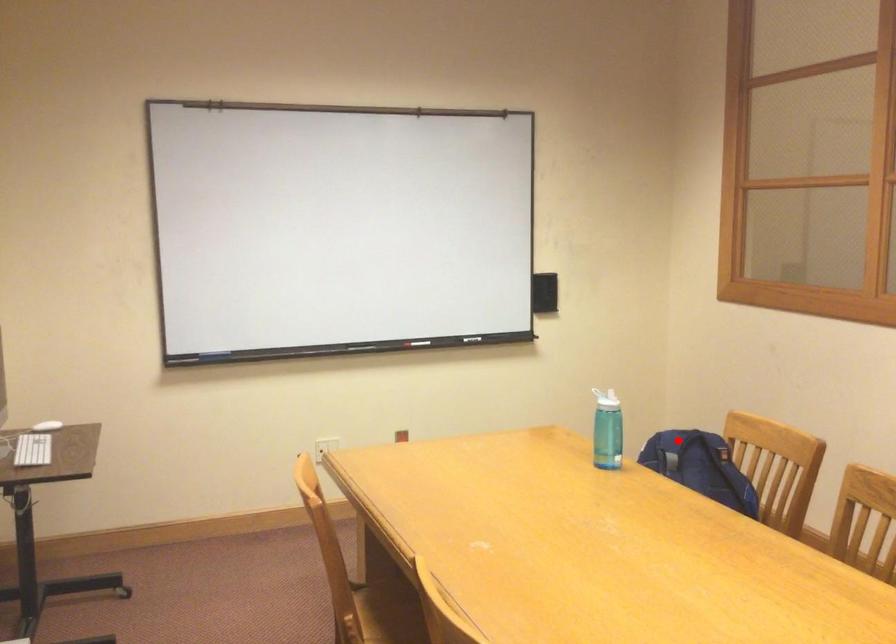
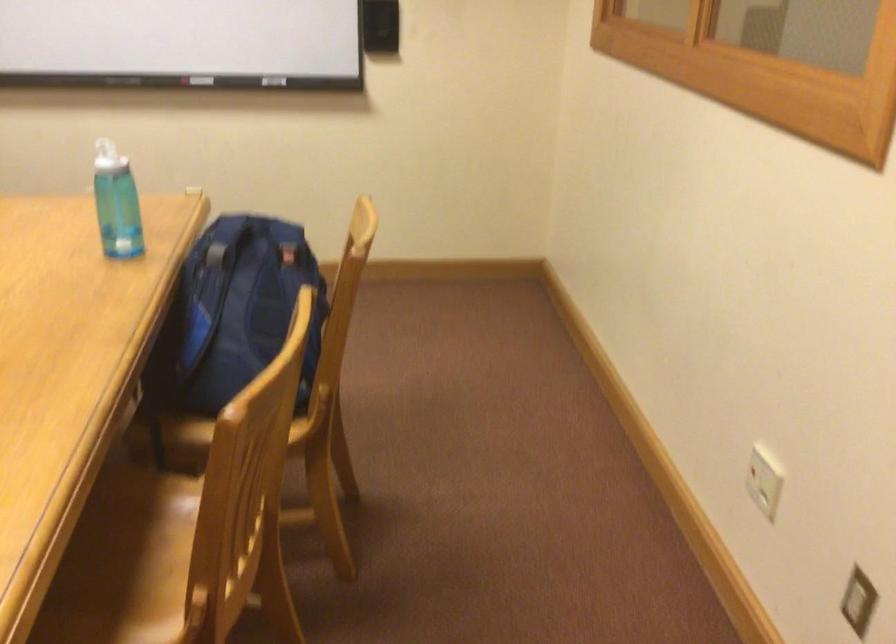
Question: I am providing you with two images of the same scene from different viewpoints. In image1, a red point is highlighted. Considering the same 3D point in image2, which of the following is correct?

Choices:
 (A) It is closer
 (B) It is farther

Answer: (A)